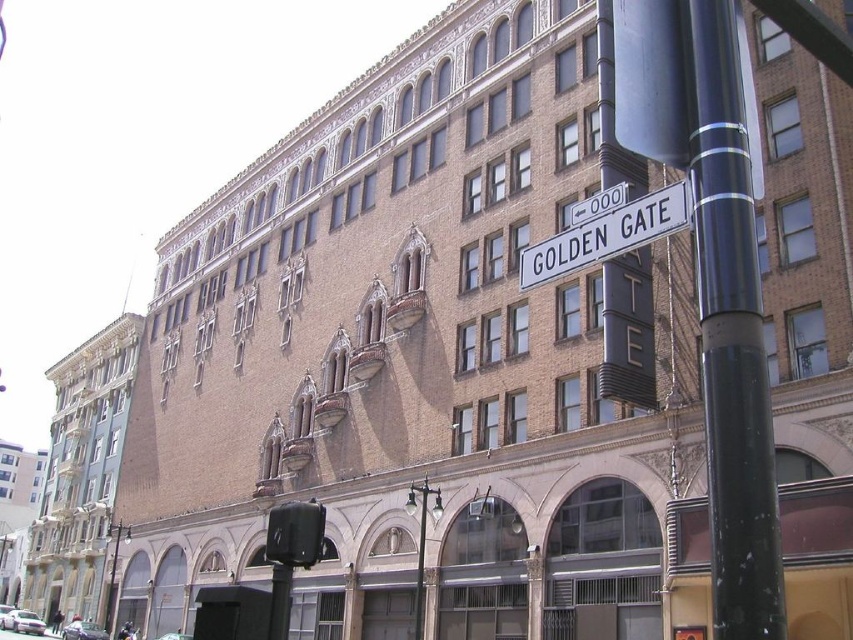
You are a delivery person trying to park your silver metallic car at lower left near the black polished pole at right. Can you safely park your car next to the pole without hitting it?

The black polished pole at right is thinner than the silver metallic car at lower left, so there should be enough space to park safely without hitting the pole.

From the picture: You are a delivery driver who needs to navigate through the city. You see the white plastic street sign at upper center and the white glossy car at lower left. Which object is narrower in width?

The white plastic street sign at upper center is thinner than the white glossy car at lower left, so the white plastic street sign at upper center is narrower in width.

You are standing on the city street looking at the building. There are two points marked on the image. Which point, point (683, 205) or point (184, 637), is closer to you?

Point (683, 205) is closer to the viewer than point (184, 637).